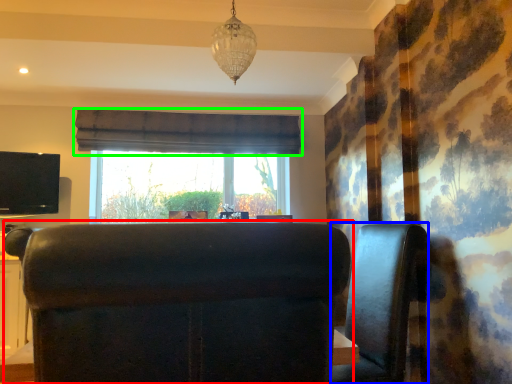
Question: Considering the real-world distances, which object is closest to furniture (highlighted by a red box)? furniture (highlighted by a blue box) or curtain (highlighted by a green box).

Choices:
 (A) furniture
 (B) curtain

Answer: (A)